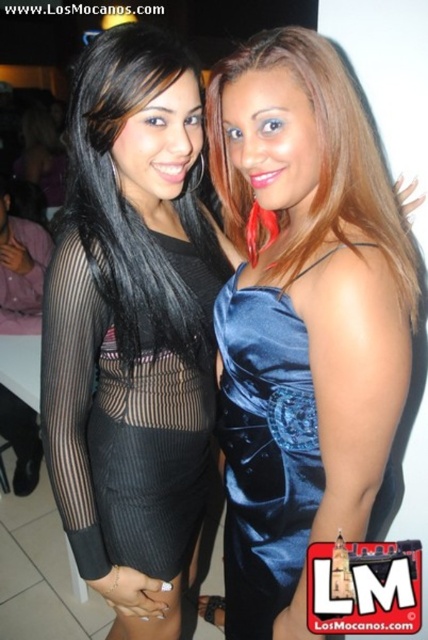
Question: Which object is positioned farthest from the satin blue dress at upper right?

Choices:
 (A) black mesh dress at center
 (B) satin blue dress at center
 (C) black sheer dress at center

Answer: (B)

Question: Which of the following is the closest to the observer?

Choices:
 (A) click(118, 506)
 (B) click(246, 497)
 (C) click(59, 369)
 (D) click(380, 250)

Answer: (D)

Question: Can you confirm if black sheer dress at center is positioned above black mesh dress at center?

Choices:
 (A) no
 (B) yes

Answer: (B)

Question: Among these points, which one is nearest to the camera?

Choices:
 (A) (80, 269)
 (B) (267, 596)

Answer: (A)

Question: Is black sheer dress at center to the right of satin blue dress at center from the viewer's perspective?

Choices:
 (A) yes
 (B) no

Answer: (B)

Question: From the image, what is the correct spatial relationship of black sheer dress at center in relation to black mesh dress at center?

Choices:
 (A) below
 (B) above

Answer: (B)